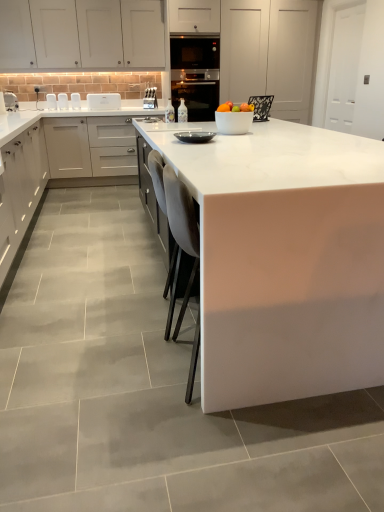
This screenshot has width=384, height=512. What do you see at coordinates (150, 98) in the screenshot?
I see `metallic knife block at center, which appears as the 3th appliance when viewed from the right` at bounding box center [150, 98].

The width and height of the screenshot is (384, 512). Describe the element at coordinates (11, 101) in the screenshot. I see `white glossy microwave at upper left, the third appliance from the front` at that location.

The width and height of the screenshot is (384, 512). I want to click on white marble countertop at center, which is the 1th countertop in right-to-left order, so 285,260.

Measure the distance between point [220,110] and camera.

2.91 meters.

Find the location of a particular element. matte white cabinets at left, acting as the second cabinetry starting from the bottom is located at coordinates (91, 147).

From the image's perspective, is black glass oven at center over matte black bowl at center, placed as the second appliance when sorted from right to left?

Yes, from the image's perspective, black glass oven at center is on top of matte black bowl at center, placed as the second appliance when sorted from right to left.

The width and height of the screenshot is (384, 512). Identify the location of home appliance located above the matte black bowl at center, placed as the second appliance when sorted from right to left (from the image's perspective). (196, 92).

From the picture: Is black glass oven at center positioned with its back to matte black bowl at center, placed as the 1th appliance when sorted from bottom to top?

No, black glass oven at center is not facing away from matte black bowl at center, placed as the 1th appliance when sorted from bottom to top.

How much distance is there between black glass oven at center and matte black bowl at center, marked as the first appliance in a front-to-back arrangement?

black glass oven at center and matte black bowl at center, marked as the first appliance in a front-to-back arrangement, are 4.15 meters apart from each other.

Locate an element on the screen. This screenshot has width=384, height=512. cabinetry that is above the black glass oven at center (from the image's perspective) is located at coordinates (81, 34).

How far apart are white matte cabinet at upper center, the first cabinetry in the top-to-bottom sequence, and black glass oven at center?

white matte cabinet at upper center, the first cabinetry in the top-to-bottom sequence, and black glass oven at center are 1.36 meters apart from each other.

Choose the correct answer: Is white matte cabinet at upper center, the 3th cabinetry from the bottom, inside black glass oven at center or outside it?

white matte cabinet at upper center, the 3th cabinetry from the bottom, is not inside black glass oven at center, it's outside.

Can you tell me how much white matte cabinet at upper center, the 3th cabinetry from the bottom, and black glass oven at center differ in facing direction?

The angular difference between white matte cabinet at upper center, the 3th cabinetry from the bottom, and black glass oven at center is 2.25 degrees.

Is white marble countertop at center, which appears as the 2th countertop when viewed from the left, at the left side of black glass oven at center?

Incorrect, white marble countertop at center, which appears as the 2th countertop when viewed from the left, is not on the left side of black glass oven at center.

Between white marble countertop at center, which appears as the 2th countertop when viewed from the left, and black glass oven at center, which one has larger width?

Wider between the two is white marble countertop at center, which appears as the 2th countertop when viewed from the left.

Which is closer to the camera, (289, 279) or (200, 76)?

Point (289, 279).

Image resolution: width=384 pixels, height=512 pixels. Find the location of `home appliance on the left of white marble countertop at center, which appears as the 2th countertop when viewed from the left`. home appliance on the left of white marble countertop at center, which appears as the 2th countertop when viewed from the left is located at coordinates tap(196, 92).

From the image's perspective, between white glossy microwave at upper left, positioned as the first appliance in left-to-right order, and black glass oven at center, which one is located above?

black glass oven at center, from the image's perspective.

Looking at this image, measure the distance from white glossy microwave at upper left, the third appliance positioned from the bottom, to black glass oven at center.

The distance of white glossy microwave at upper left, the third appliance positioned from the bottom, from black glass oven at center is 2.54 meters.

From a real-world perspective, is white glossy microwave at upper left, which is the 2th appliance from back to front, above or below black glass oven at center?

Clearly, from a real-world perspective, white glossy microwave at upper left, which is the 2th appliance from back to front, is above black glass oven at center.

From their relative heights in the image, would you say white glossy microwave at upper left, acting as the second appliance starting from the top, is taller or shorter than black glass oven at center?

white glossy microwave at upper left, acting as the second appliance starting from the top, is shorter than black glass oven at center.

From the picture: Between white marble countertop at center, which is the 1th countertop in right-to-left order, and white matte cabinet at upper center, the 3th cabinetry from the bottom, which one has less height?

With less height is white matte cabinet at upper center, the 3th cabinetry from the bottom.

Does point (326, 202) lie in front of point (8, 7)?

Yes, point (326, 202) is in front of point (8, 7).

Which object is further away from the camera, white marble countertop at center, which appears as the 2th countertop when viewed from the left, or white matte cabinet at upper center, the 3th cabinetry from the bottom?

Positioned behind is white matte cabinet at upper center, the 3th cabinetry from the bottom.

How much distance is there between white marble countertop at center, which appears as the 2th countertop when viewed from the left, and white matte cabinet at upper center, the 3th cabinetry from the bottom?

A distance of 4.30 meters exists between white marble countertop at center, which appears as the 2th countertop when viewed from the left, and white matte cabinet at upper center, the 3th cabinetry from the bottom.

From the image's perspective, is white glossy bowl at center, which appears as the third appliance when viewed from the top, positioned above or below white glossy countertop at center, which ranks as the first countertop in left-to-right order?

white glossy bowl at center, which appears as the third appliance when viewed from the top, is situated higher than white glossy countertop at center, which ranks as the first countertop in left-to-right order, in the image.

What are the coordinates of `countertop on the left side of white glossy bowl at center, the 1th appliance in the right-to-left sequence` in the screenshot? It's located at (40, 165).

Consider the image. Is there a large distance between white glossy bowl at center, which is counted as the 2th appliance, starting from the bottom, and white glossy countertop at center, which ranks as the first countertop in left-to-right order?

white glossy bowl at center, which is counted as the 2th appliance, starting from the bottom, is far away from white glossy countertop at center, which ranks as the first countertop in left-to-right order.

Which is more to the right, white glossy bowl at center, which appears as the third appliance when viewed from the top, or white glossy countertop at center, which ranks as the first countertop in left-to-right order?

Positioned to the right is white glossy bowl at center, which appears as the third appliance when viewed from the top.

Consider the image. Is white glossy countertop at center, which ranks as the first countertop in left-to-right order, turned away from white marble countertop at center, which is the 1th countertop in right-to-left order?

white glossy countertop at center, which ranks as the first countertop in left-to-right order, does not have its back to white marble countertop at center, which is the 1th countertop in right-to-left order.

Which is more to the right, white glossy countertop at center, the 2th countertop positioned from the right, or white marble countertop at center, which appears as the 2th countertop when viewed from the left?

From the viewer's perspective, white marble countertop at center, which appears as the 2th countertop when viewed from the left, appears more on the right side.

Is white glossy countertop at center, which ranks as the first countertop in left-to-right order, taller than white marble countertop at center, which is the 1th countertop in right-to-left order?

No.

I want to click on home appliance lying above the matte black bowl at center, placed as the 1th appliance when sorted from bottom to top (from the image's perspective), so click(x=196, y=92).

Starting from the black glass oven at center, which cabinetry is the 2nd one in front? Please provide its 2D coordinates.

[(81, 34)]

Considering their positions, is white marble countertop at center, which appears as the 2th countertop when viewed from the left, positioned closer to white matte cabinet at upper center, the 3th cabinetry from the bottom, than matte white cabinets at left, acting as the second cabinetry starting from the bottom?

Result: Based on the image, matte white cabinets at left, acting as the second cabinetry starting from the bottom, appears to be nearer to white matte cabinet at upper center, the 3th cabinetry from the bottom.

Considering their positions, is metallic knife block at center, which appears as the 3th appliance when viewed from the right, positioned further to white glossy countertop at center, the 2th countertop positioned from the right, than white glossy microwave at upper center?

Based on the image, metallic knife block at center, which appears as the 3th appliance when viewed from the right, appears to be further to white glossy countertop at center, the 2th countertop positioned from the right.

Considering their positions, is matte black bowl at center, marked as the first appliance in a front-to-back arrangement, positioned further to white glossy bowl at center, acting as the second appliance starting from the front, than white matte cabinet at upper center, the first cabinetry in the top-to-bottom sequence?

white matte cabinet at upper center, the first cabinetry in the top-to-bottom sequence, lies further to white glossy bowl at center, acting as the second appliance starting from the front, than the other object.

Based on their spatial positions, is white glossy bowl at center, which appears as the third appliance when viewed from the top, or white marble countertop at center, which is the 1th countertop in right-to-left order, closer to black glass oven at center?

white glossy bowl at center, which appears as the third appliance when viewed from the top.

From the image, which object appears to be farther from white marble countertop at center, which appears as the 2th countertop when viewed from the left, white matte cabinet at upper center, the 3th cabinetry from the bottom, or matte white cabinets at left, which ranks as the 2th cabinetry in top-to-bottom order?

white matte cabinet at upper center, the 3th cabinetry from the bottom, is further to white marble countertop at center, which appears as the 2th countertop when viewed from the left.

Estimate the real-world distances between objects in this image. Which object is closer to matte white cabinets at left, which ranks as the 2th cabinetry in top-to-bottom order, black glass oven at center or white glossy countertop at center, which ranks as the first countertop in left-to-right order?

white glossy countertop at center, which ranks as the first countertop in left-to-right order.

Which object lies nearer to the anchor point white marble countertop at center, which appears as the 2th countertop when viewed from the left, white matte cabinet at left, the 1th cabinetry ordered from the bottom, or matte white cabinets at left, acting as the second cabinetry starting from the bottom?

white matte cabinet at left, the 1th cabinetry ordered from the bottom, lies closer to white marble countertop at center, which appears as the 2th countertop when viewed from the left, than the other object.

Considering their positions, is matte white cabinets at left, acting as the second cabinetry starting from the bottom, positioned further to white glossy bowl at center, acting as the second appliance starting from the front, than black glass oven at center?

The object further to white glossy bowl at center, acting as the second appliance starting from the front, is black glass oven at center.

You are a GUI agent. You are given a task and a screenshot of the screen. Output one action in this format:
    pyautogui.click(x=<x>, y=<y>)
    Task: Click on the home appliance between white marble countertop at center, which is the 1th countertop in right-to-left order, and white glossy microwave at upper center from front to back
    
    Given the screenshot: What is the action you would take?
    pyautogui.click(x=196, y=92)

The width and height of the screenshot is (384, 512). I want to click on countertop between white matte cabinet at left, the 3th cabinetry when ordered from top to bottom, and white marble countertop at center, which is the 1th countertop in right-to-left order, from left to right, so click(x=40, y=165).

At what (x,y) coordinates should I click in order to perform the action: click on countertop between white marble countertop at center, which is the 1th countertop in right-to-left order, and white glossy microwave at upper center in the front-back direction. Please return your answer as a coordinate pair (x, y). Image resolution: width=384 pixels, height=512 pixels. Looking at the image, I should click on (40, 165).

What are the coordinates of `kitchen appliance between white marble countertop at center, which is the 1th countertop in right-to-left order, and metallic knife block at center, which appears as the 3th appliance when viewed from the right, in the front-back direction` in the screenshot? It's located at (103, 101).